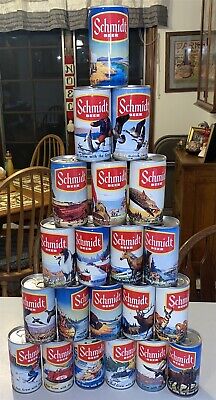
Where is `tabletop`? The height and width of the screenshot is (400, 216). tabletop is located at coordinates (199, 320).